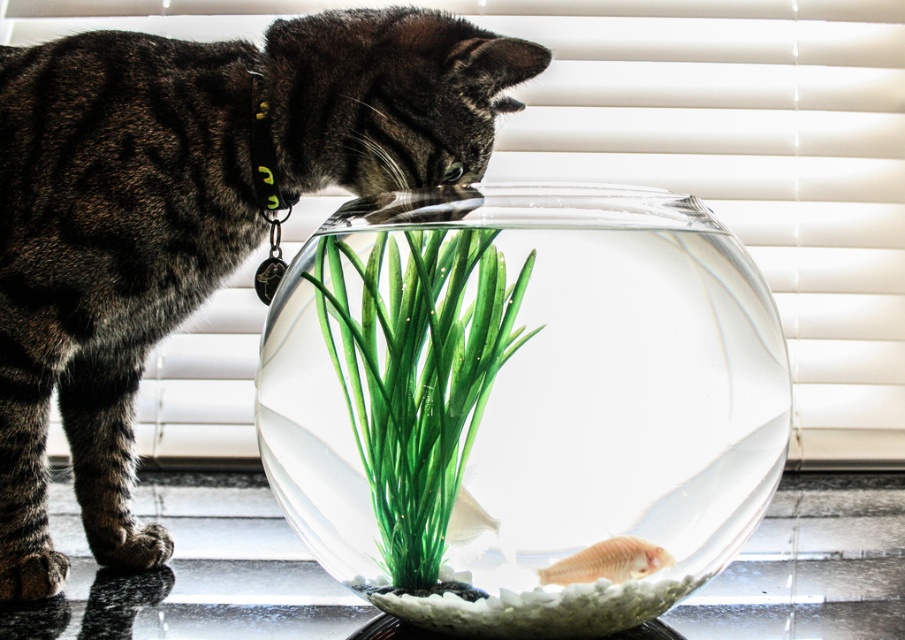
Does green plastic plant at center appear on the left side of translucent plastic fish at center?

Yes, green plastic plant at center is to the left of translucent plastic fish at center.

I want to click on green plastic plant at center, so click(417, 372).

Find the location of a particular element. The width and height of the screenshot is (905, 640). green plastic plant at center is located at coordinates (417, 372).

Between dark brown fur cat at left and translucent plastic fish at center, which one has less height?

translucent plastic fish at center is shorter.

Locate an element on the screen. The height and width of the screenshot is (640, 905). dark brown fur cat at left is located at coordinates (188, 212).

Measure the distance between transparent glass bowl at center and camera.

5.23 inches

Based on the photo, is transparent glass bowl at center bigger than dark brown fur cat at left?

No.

Is point (625, 410) positioned in front of point (116, 499)?

Yes, point (625, 410) is closer to viewer.

Where is `transparent glass bowl at center`? This screenshot has width=905, height=640. transparent glass bowl at center is located at coordinates (521, 401).